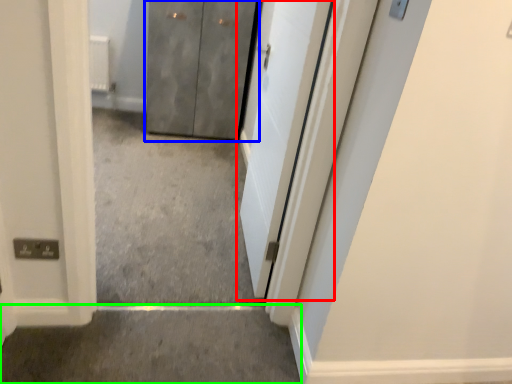
Question: Which is farther away from door (highlighted by a red box)? door (highlighted by a blue box) or concrete (highlighted by a green box)?

Choices:
 (A) door
 (B) concrete

Answer: (A)